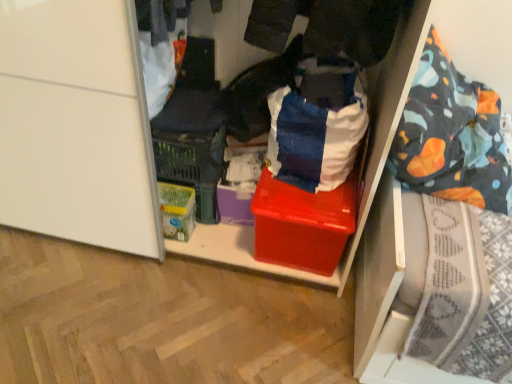
Question: From the image's perspective, is white cotton shirt at upper left, the first clothing positioned from the left, positioned above or below blue cotton shirt at center, positioned as the 2th clothing in left-to-right order?

Choices:
 (A) above
 (B) below

Answer: (A)

Question: Choose the correct answer: Is white cotton shirt at upper left, the first clothing positioned from the left, inside blue cotton shirt at center, positioned as the 2th clothing in left-to-right order, or outside it?

Choices:
 (A) outside
 (B) inside

Answer: (A)

Question: Which is nearer to the blue cotton shirt at center, positioned as the 2th clothing in left-to-right order?

Choices:
 (A) shiny plastic box at center
 (B) white cotton shirt at upper left, arranged as the second clothing when viewed from the right
 (C) green cardboard box at lower left

Answer: (B)

Question: Which object is positioned farthest from the green cardboard box at lower left?

Choices:
 (A) white cotton shirt at upper left, the first clothing positioned from the left
 (B) blue cotton shirt at center, positioned as the 2th clothing in left-to-right order
 (C) shiny plastic box at center

Answer: (A)